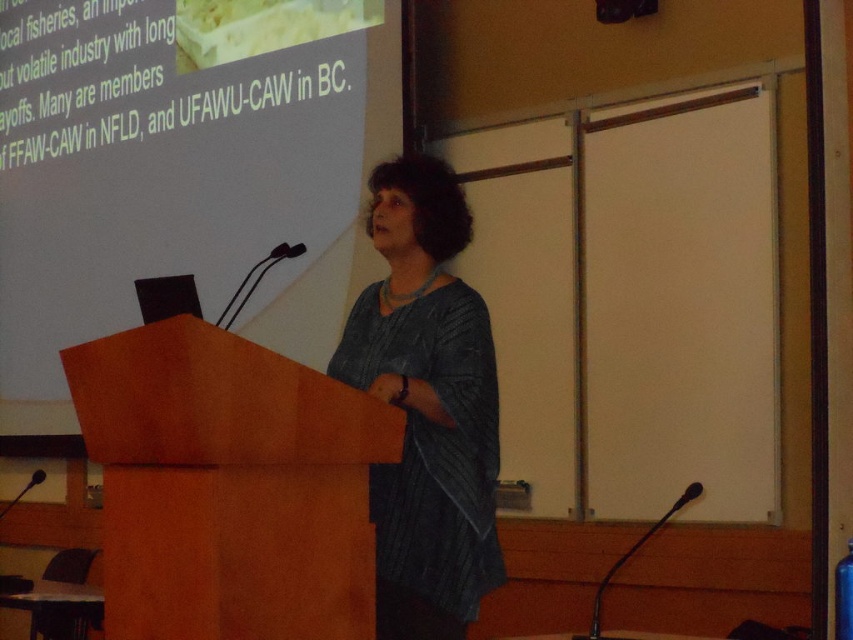
You are an event organizer setting up a conference room. You have a 1.2 meter wide podium that needs to be placed in the room. The room has a screen that is wider than the podium. Based on the image, will the white matte projection screen at upper center fit on the wall if the wooden podium at center is already occupying 1.2 meters of space?

The white matte projection screen at upper center has a larger width than the wooden podium at center. Since the podium is 1.2 meters wide, the screen must be wider than 1.2 meters. Therefore, the screen will require more space than the podium, so it may not fit if the wall space is only accommodating the 1.2 meter podium.

You are a sound technician adjusting the microphones on the podium. You need to ensure that the sound from the speaker wearing the textured gray sweater at center is clear. Considering the distance between the speaker and the white matte projection screen at upper center, is the current microphone placement likely to pick up the speaker clearly?

The distance between the white matte projection screen at upper center and the textured gray sweater at center is 6.16 feet. Since microphones typically have an effective range of about 6 feet, the speaker wearing the textured gray sweater at center may be slightly out of the optimal range, potentially leading to reduced audio clarity. Adjusting the microphone closer or using a lapel microphone might improve sound quality.